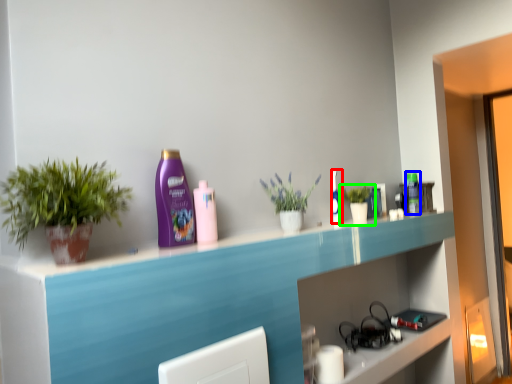
Question: Based on their relative distances, which object is nearer to mouthwash (highlighted by a red box)? Choose from mouthwash (highlighted by a blue box) and houseplant (highlighted by a green box).

Choices:
 (A) mouthwash
 (B) houseplant

Answer: (B)